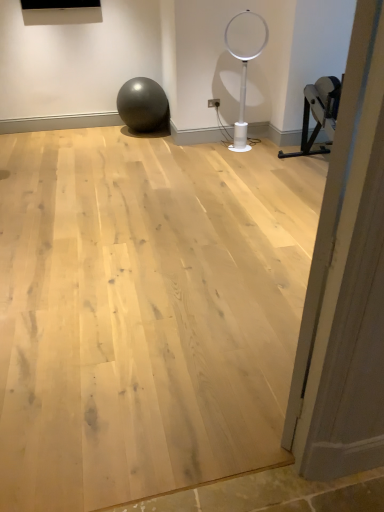
This screenshot has width=384, height=512. Identify the location of natural wood floor at center. (145, 312).

Locate an element on the screen. Image resolution: width=384 pixels, height=512 pixels. wooden door at right is located at coordinates (346, 283).

What do you see at coordinates (143, 105) in the screenshot? I see `matte gray ball at center` at bounding box center [143, 105].

Find the location of `natural wood floor at center`. natural wood floor at center is located at coordinates (145, 312).

From a real-world perspective, between matte gray ball at center and wooden door at right, who is vertically lower?

matte gray ball at center.

Does matte gray ball at center come behind wooden door at right?

Yes, matte gray ball at center is further from the viewer.

Can you tell me how much matte gray ball at center and wooden door at right differ in facing direction?

There is a 143-degree angle between the facing directions of matte gray ball at center and wooden door at right.

Is matte gray ball at center facing towards wooden door at right?

Yes, matte gray ball at center is aimed at wooden door at right.

Is natural wood floor at center inside or outside of white plastic basketball hoop at center?

natural wood floor at center cannot be found inside white plastic basketball hoop at center.

Which object is more forward, natural wood floor at center or white plastic basketball hoop at center?

natural wood floor at center is in front.

Is natural wood floor at center next to white plastic basketball hoop at center?

No.

Is white plastic basketball hoop at center in contact with wooden door at right?

white plastic basketball hoop at center and wooden door at right are not in contact.

From a real-world perspective, is white plastic basketball hoop at center under wooden door at right?

Correct, in the physical world, white plastic basketball hoop at center is lower than wooden door at right.

Is white plastic basketball hoop at center facing away from wooden door at right?

No, white plastic basketball hoop at center is not facing away from wooden door at right.

From a real-world perspective, is white plastic basketball hoop at center physically located above or below natural wood floor at center?

Clearly, from a real-world perspective, white plastic basketball hoop at center is above natural wood floor at center.

Does white plastic basketball hoop at center have a smaller size compared to natural wood floor at center?

Yes, white plastic basketball hoop at center is smaller than natural wood floor at center.

Can you tell me how much white plastic basketball hoop at center and natural wood floor at center differ in facing direction?

white plastic basketball hoop at center and natural wood floor at center are facing 18.6 degrees away from each other.

Can you confirm if matte gray ball at center is taller than natural wood floor at center?

Yes, matte gray ball at center is taller than natural wood floor at center.

Based on the photo, based on their positions, is matte gray ball at center located to the left or right of natural wood floor at center?

matte gray ball at center is positioned on natural wood floor at center's left side.

Is matte gray ball at center next to natural wood floor at center and touching it?

matte gray ball at center and natural wood floor at center are not in contact.

Where is `ball behind the natural wood floor at center`? ball behind the natural wood floor at center is located at coordinates (143, 105).

Which object is positioned more to the right, wooden door at right or matte gray ball at center?

wooden door at right is more to the right.

Can you confirm if wooden door at right is smaller than matte gray ball at center?

Yes.

Considering the sizes of objects natural wood floor at center and wooden door at right in the image provided, who is wider, natural wood floor at center or wooden door at right?

Wider between the two is natural wood floor at center.

Who is bigger, natural wood floor at center or wooden door at right?

natural wood floor at center is bigger.

Between natural wood floor at center and wooden door at right, which one has more height?

Standing taller between the two is wooden door at right.

What's the angular difference between natural wood floor at center and wooden door at right's facing directions?

natural wood floor at center and wooden door at right are facing 141 degrees away from each other.

Identify the location of door to the right of matte gray ball at center. (346, 283).

Locate an element on the screen. This screenshot has height=512, width=384. plywood that is below the white plastic basketball hoop at center (from the image's perspective) is located at coordinates (145, 312).

Which object lies further to the anchor point wooden door at right, natural wood floor at center or white plastic basketball hoop at center?

white plastic basketball hoop at center lies further to wooden door at right than the other object.

Which object lies nearer to the anchor point natural wood floor at center, wooden door at right or white plastic basketball hoop at center?

wooden door at right is closer to natural wood floor at center.

Based on their spatial positions, is natural wood floor at center or matte gray ball at center further from white plastic basketball hoop at center?

natural wood floor at center is positioned further to the anchor white plastic basketball hoop at center.

Which object lies further to the anchor point matte gray ball at center, white plastic basketball hoop at center or natural wood floor at center?

The object further to matte gray ball at center is natural wood floor at center.

From the image, which object appears to be farther from white plastic basketball hoop at center, wooden door at right or matte gray ball at center?

wooden door at right is further to white plastic basketball hoop at center.

Considering their positions, is matte gray ball at center positioned closer to white plastic basketball hoop at center than wooden door at right?

Based on the image, matte gray ball at center appears to be nearer to white plastic basketball hoop at center.

Which object lies further to the anchor point wooden door at right, matte gray ball at center or natural wood floor at center?

matte gray ball at center.

From the image, which object appears to be farther from wooden door at right, white plastic basketball hoop at center or matte gray ball at center?

matte gray ball at center lies further to wooden door at right than the other object.

Where is `plywood located between wooden door at right and matte gray ball at center in the depth direction`? This screenshot has width=384, height=512. plywood located between wooden door at right and matte gray ball at center in the depth direction is located at coordinates (145, 312).

Locate an element on the screen. This screenshot has width=384, height=512. plywood between wooden door at right and white plastic basketball hoop at center along the z-axis is located at coordinates (145, 312).

The image size is (384, 512). Find the location of `basketball hoop located between natural wood floor at center and matte gray ball at center in the depth direction`. basketball hoop located between natural wood floor at center and matte gray ball at center in the depth direction is located at coordinates (244, 61).

This screenshot has width=384, height=512. In order to click on basketball hoop between wooden door at right and matte gray ball at center along the z-axis in this screenshot , I will do `click(244, 61)`.